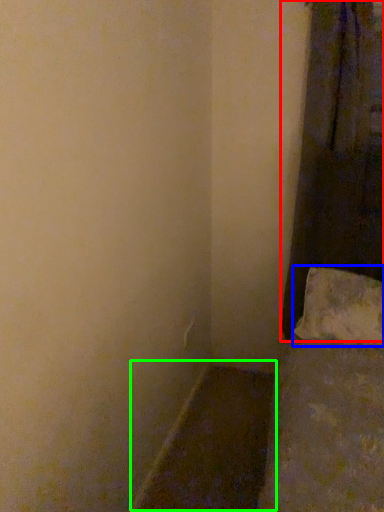
Question: Based on their relative distances, which object is nearer to curtain (highlighted by a red box)? Choose from pillow (highlighted by a blue box) and window sill (highlighted by a green box).

Choices:
 (A) pillow
 (B) window sill

Answer: (A)